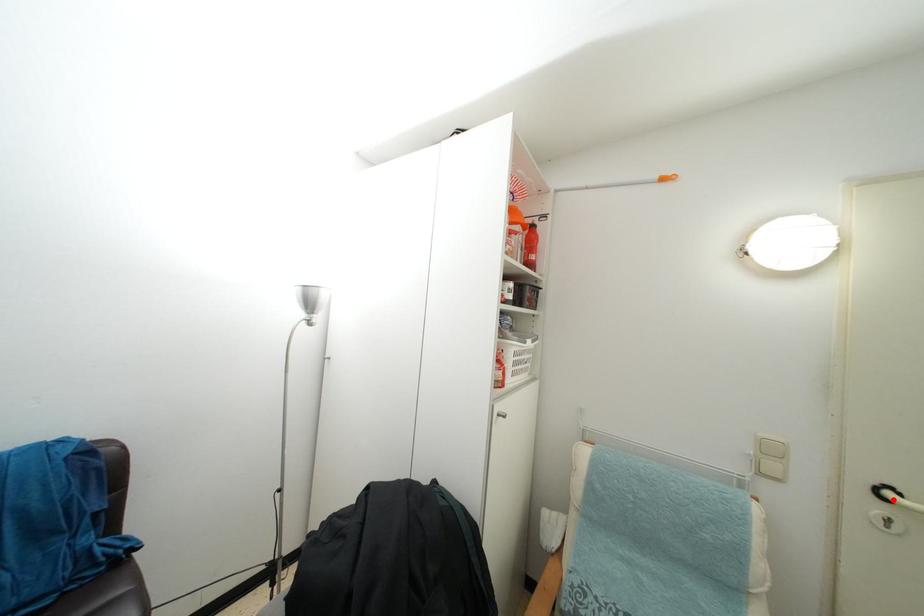
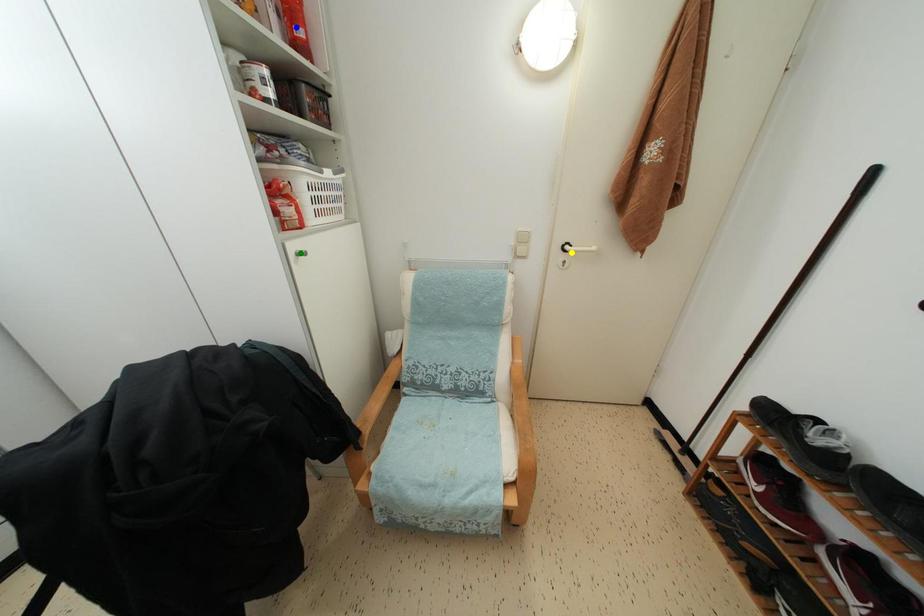
Question: I am providing you with two images of the same scene from different viewpoints. A red point is marked on the first image. You are given multiple points on the second image. Which spot in image 2 lines up with the point in image 1?

Choices:
 (A) green point
 (B) blue point
 (C) yellow point

Answer: (C)